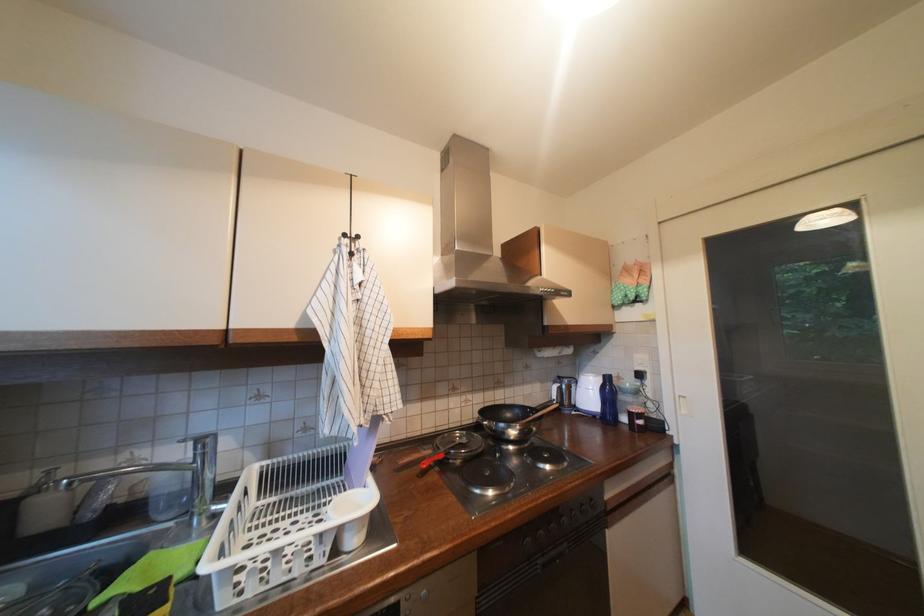
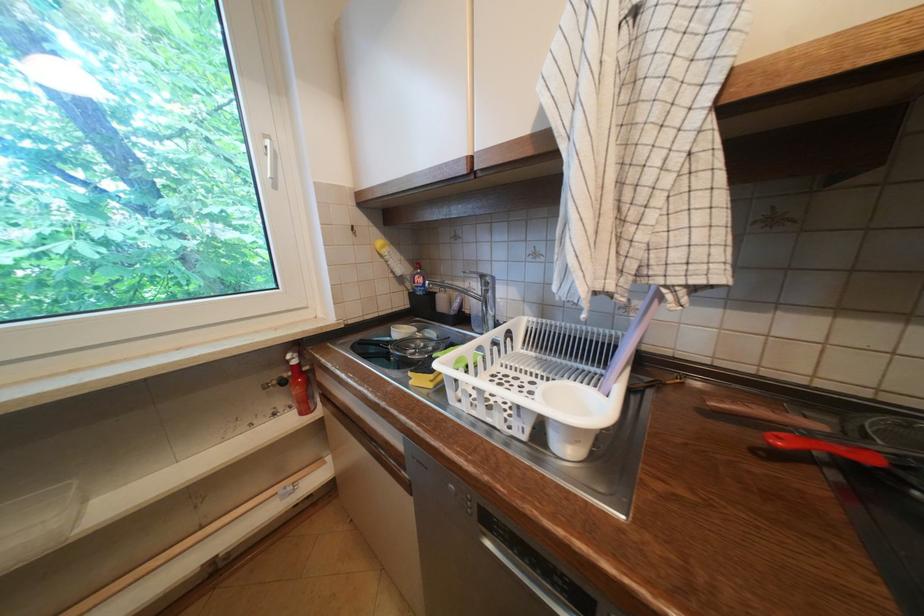
Find the pixel in the second image that matches point 432,464 in the first image.

(788, 440)